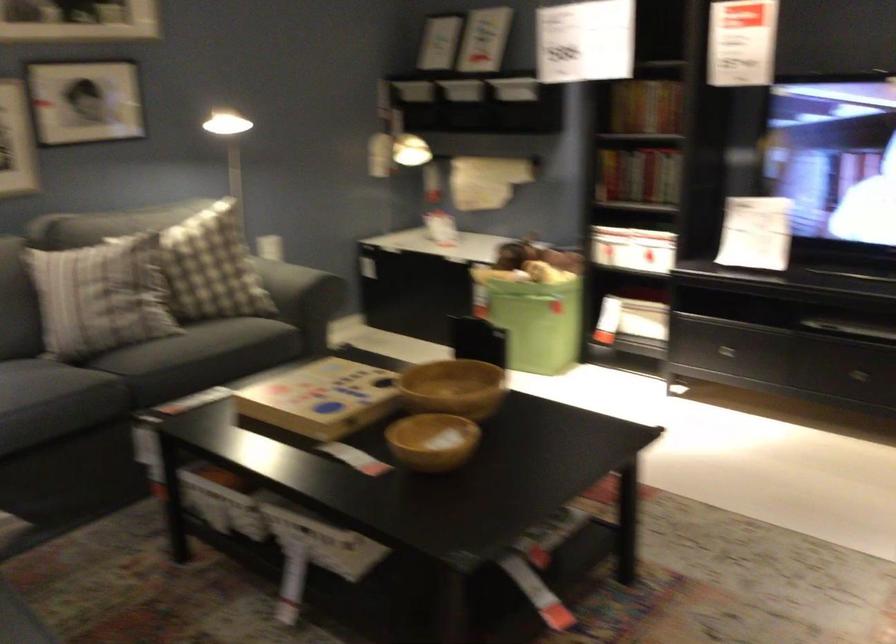
What do you see at coordinates (199, 357) in the screenshot? This screenshot has height=644, width=896. I see `the sofa sitting surface` at bounding box center [199, 357].